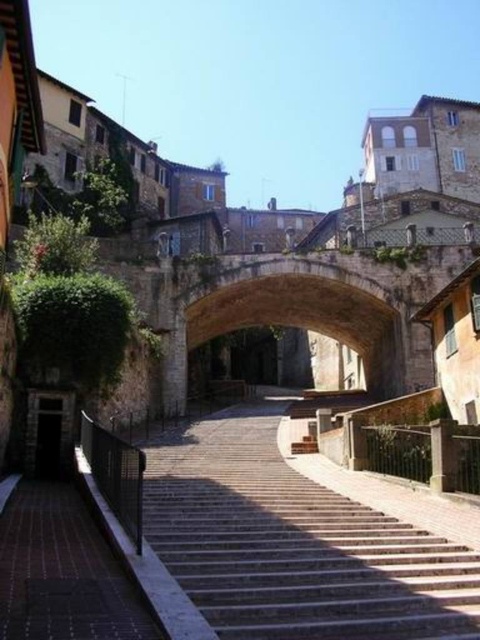
Question: Observing the image, what is the correct spatial positioning of smooth stone stairs at center in reference to brown stone archway at center?

Choices:
 (A) left
 (B) right

Answer: (A)

Question: Which object appears farthest from the camera in this image?

Choices:
 (A) smooth stone stairs at center
 (B) brown stone archway at center

Answer: (B)

Question: Can you confirm if smooth stone stairs at center is thinner than brown stone archway at center?

Choices:
 (A) yes
 (B) no

Answer: (A)

Question: Does smooth stone stairs at center come in front of brown stone archway at center?

Choices:
 (A) yes
 (B) no

Answer: (A)

Question: Which point is farther from the camera taking this photo?

Choices:
 (A) (244, 465)
 (B) (393, 321)

Answer: (B)